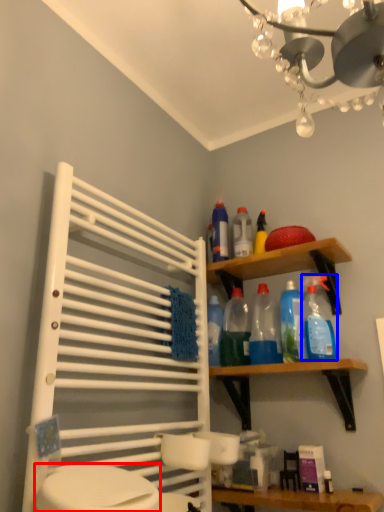
Question: Among these objects, which one is nearest to the camera, toilet bowl (highlighted by a red box) or cleaning product (highlighted by a blue box)?

Choices:
 (A) toilet bowl
 (B) cleaning product

Answer: (A)